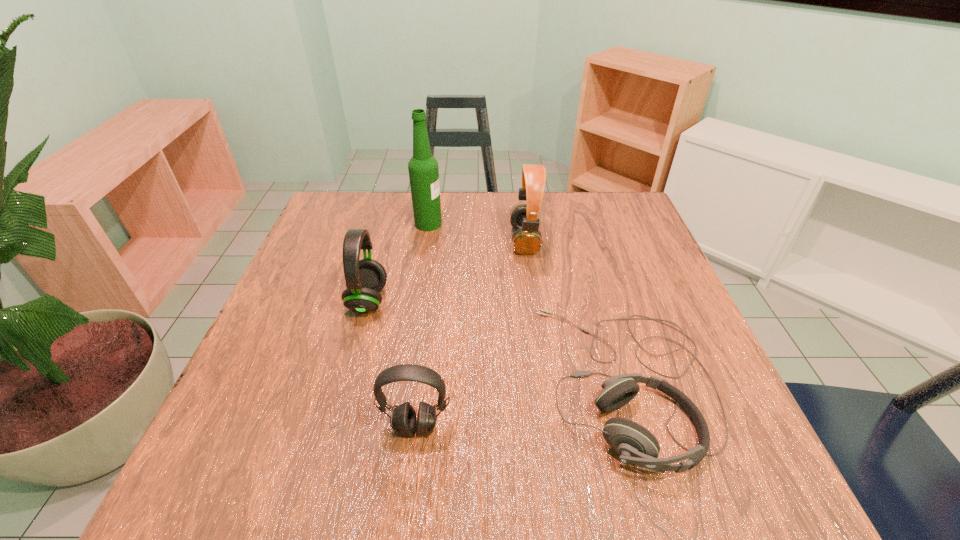
Locate an element on the screen. vacant area located on the ear cups of the leftmost object is located at coordinates (462, 301).

The height and width of the screenshot is (540, 960). What are the coordinates of `free space located on the outer surface of the shortest headset` in the screenshot? It's located at (471, 383).

At what (x,y) coordinates should I click in order to perform the action: click on free spot located 0.060m on the outer surface of the shortest headset. Please return your answer as a coordinate pair (x, y). The width and height of the screenshot is (960, 540). Looking at the image, I should click on (512, 383).

Where is `vacant space located 0.350m on the outer surface of the shortest headset`? This screenshot has height=540, width=960. vacant space located 0.350m on the outer surface of the shortest headset is located at coordinates (348, 383).

The height and width of the screenshot is (540, 960). Find the location of `beer bottle located in the far edge section of the desktop`. beer bottle located in the far edge section of the desktop is located at coordinates (423, 169).

This screenshot has width=960, height=540. I want to click on headset positioned at the far edge, so click(x=527, y=240).

This screenshot has width=960, height=540. I want to click on object at the left edge, so click(365, 278).

Where is `object that is at the right edge`? The width and height of the screenshot is (960, 540). object that is at the right edge is located at coordinates (634, 444).

You are a GUI agent. You are given a task and a screenshot of the screen. Output one action in this format:
    pyautogui.click(x=<x>, y=<y>)
    Task: Click on the object that is positioned at the near right corner
    The height and width of the screenshot is (540, 960).
    Given the screenshot: What is the action you would take?
    pyautogui.click(x=634, y=444)

Where is `vacant area at the far edge of the desktop`? The image size is (960, 540). vacant area at the far edge of the desktop is located at coordinates pyautogui.click(x=566, y=221).